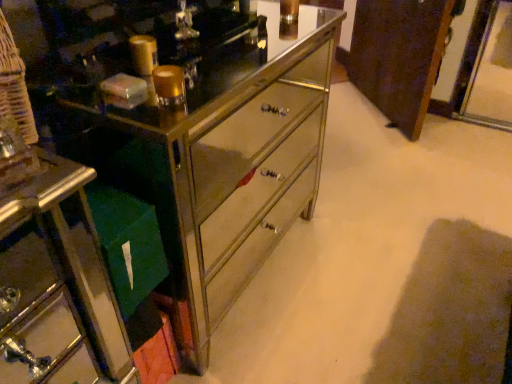
Locate an element on the screen. free spot to the right of green fabric bag at lower left is located at coordinates (293, 296).